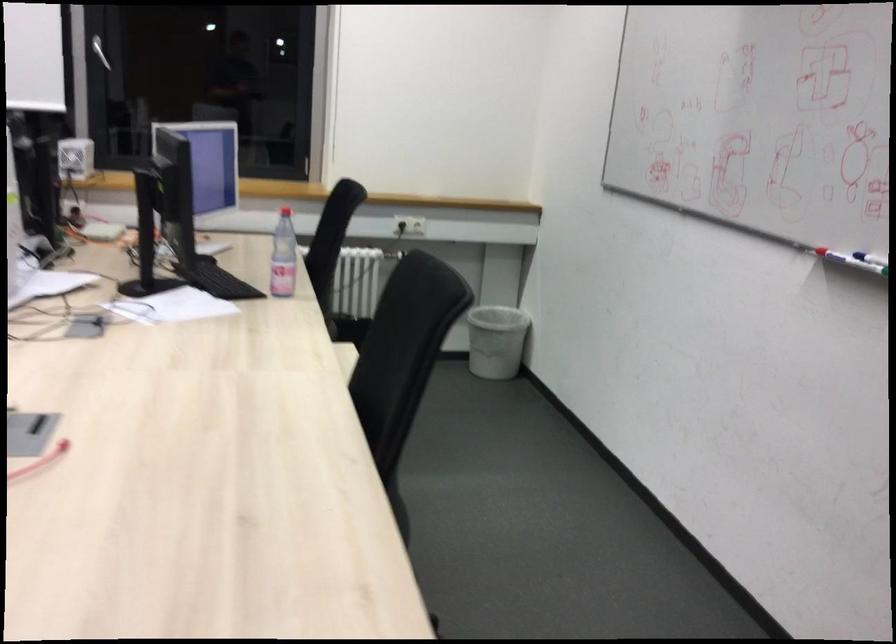
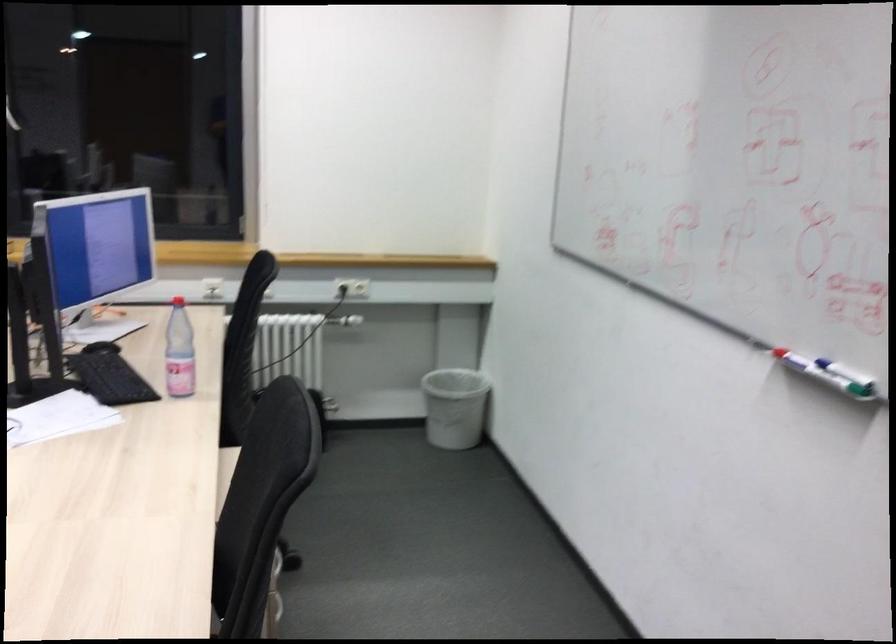
Where in the second image is the point corresponding to the point at 340,232 from the first image?

(246, 319)